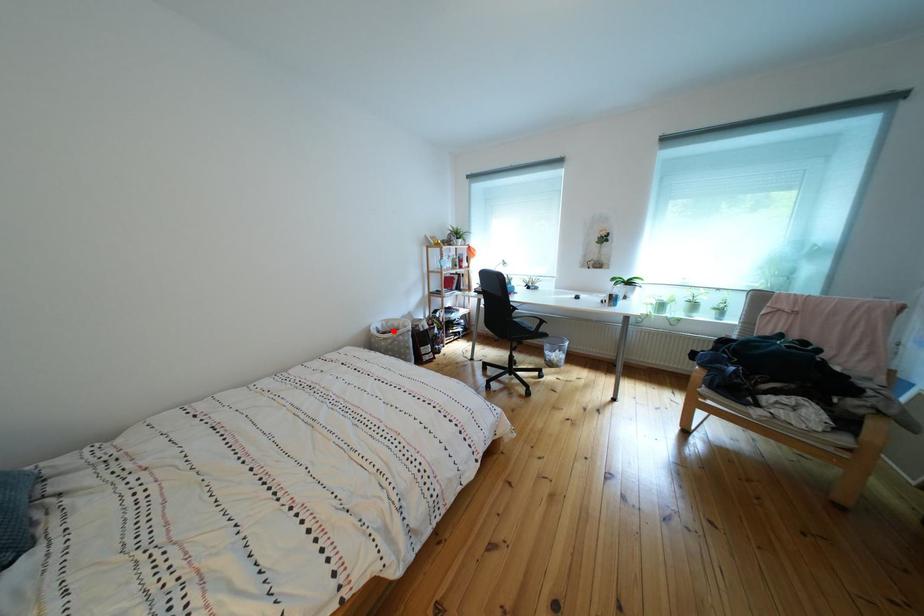
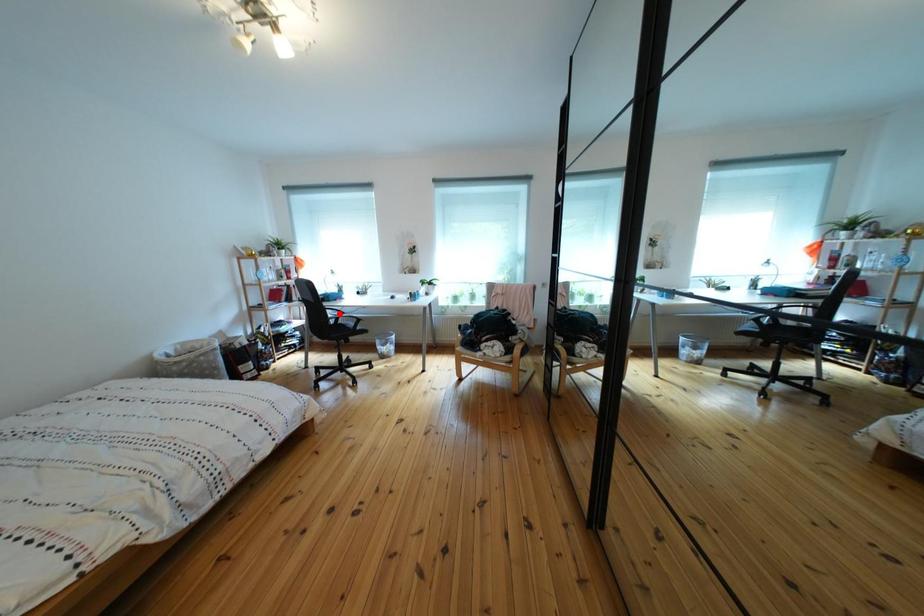
I am providing you with two images of the same scene from different viewpoints. A red point is marked on the first image and another point is marked on the second image. Are the points marked in image1 and image2 representing the same 3D position?

No